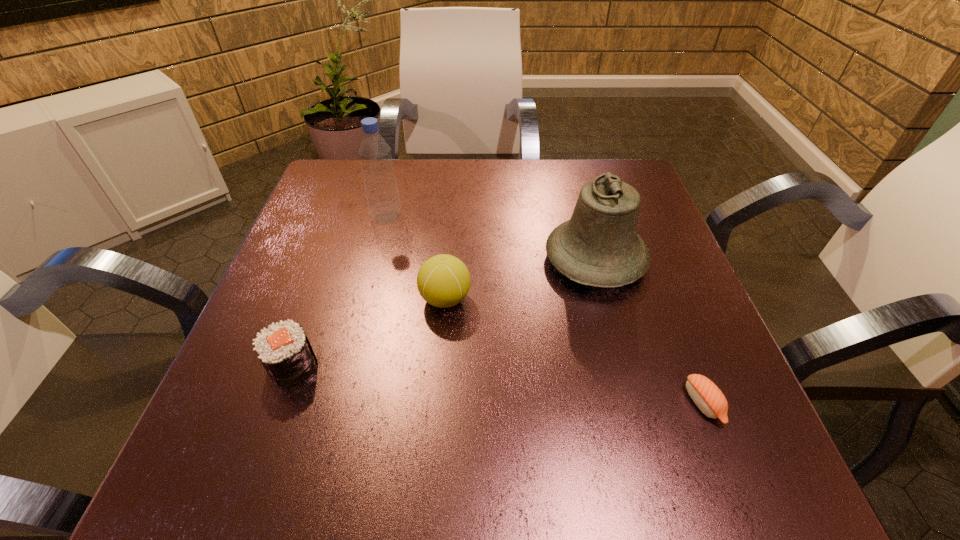
I want to click on the second object from left to right, so click(380, 184).

The height and width of the screenshot is (540, 960). In order to click on the farthest object in this screenshot , I will do [380, 184].

You are a GUI agent. You are given a task and a screenshot of the screen. Output one action in this format:
    pyautogui.click(x=<x>, y=<y>)
    Task: Click on the second tallest object
    
    Given the screenshot: What is the action you would take?
    pyautogui.click(x=599, y=246)

Find the location of a particular element. This screenshot has height=540, width=960. tennis ball is located at coordinates (443, 280).

Identify the location of the third shortest object. Image resolution: width=960 pixels, height=540 pixels. [443, 280].

The image size is (960, 540). Identify the location of the leftmost object. (284, 350).

This screenshot has width=960, height=540. What are the coordinates of `the fourth tallest object` in the screenshot? It's located at (284, 350).

Find the location of a particular element. the right sushi is located at coordinates (706, 395).

Identify the location of the shortest object. (706, 395).

Find the location of a particular element. Image resolution: width=960 pixels, height=540 pixels. vacant space located on the front of the fourth object from right to left is located at coordinates [352, 355].